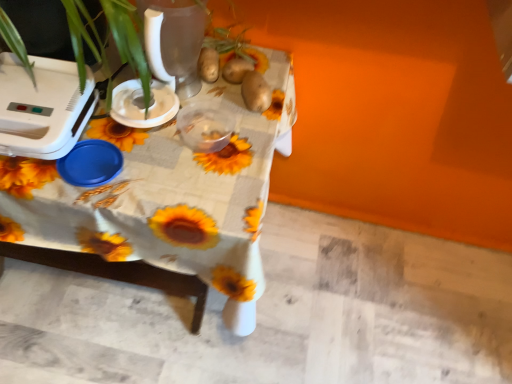
Question: Does point (257, 56) appear closer or farther from the camera than point (256, 89)?

Choices:
 (A) closer
 (B) farther

Answer: (B)

Question: From the image's perspective, is brown matte potato at upper center positioned above or below brown matte potato at center, acting as the 1th potato starting from the right?

Choices:
 (A) below
 (B) above

Answer: (B)

Question: Estimate the real-world distances between objects in this image. Which object is farther from the white plastic appliance at left, the 2th appliance when ordered from right to left?

Choices:
 (A) brown matte potato at center, which is the 2th potato in left-to-right order
 (B) white plastic blender at upper left, which appears as the first appliance when viewed from the right
 (C) brown matte potato at upper center, which appears as the second potato when viewed from the right
 (D) brown matte potato at upper center
 (E) sunflower-patterned fabric at center

Answer: (A)

Question: Based on their relative distances, which object is nearer to the brown matte potato at upper center, which appears as the second potato when viewed from the right?

Choices:
 (A) white plastic appliance at left, the 2th appliance when ordered from right to left
 (B) white plastic blender at upper left, which appears as the first appliance when viewed from the right
 (C) brown matte potato at center, acting as the 1th potato starting from the right
 (D) sunflower-patterned fabric at center
 (E) brown matte potato at upper center

Answer: (E)